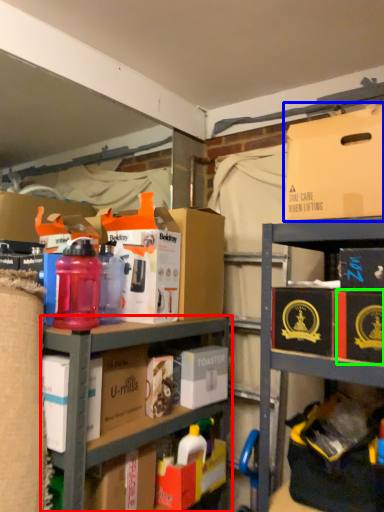
Question: Based on their relative distances, which object is nearer to shelf (highlighted by a red box)? Choose from box (highlighted by a blue box) and storage box (highlighted by a green box).

Choices:
 (A) box
 (B) storage box

Answer: (B)